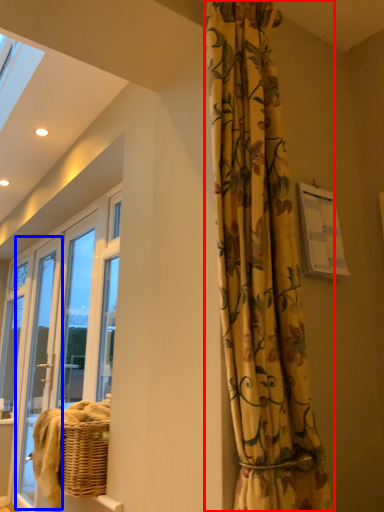
Question: Which of the following is the closest to the observer, curtain (highlighted by a red box) or screen door (highlighted by a blue box)?

Choices:
 (A) curtain
 (B) screen door

Answer: (A)